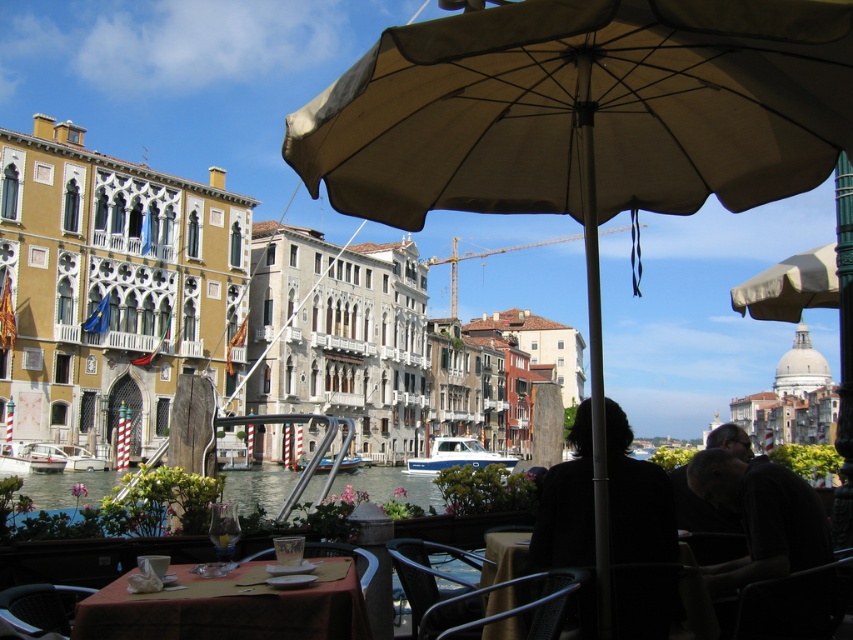
Who is more distant from viewer, [840,65] or [579,573]?

The point [579,573] is behind.

Can you confirm if beige fabric umbrella at center is positioned below metallic silver chair at lower center?

Actually, beige fabric umbrella at center is above metallic silver chair at lower center.

Who is more distant from viewer, [606,35] or [564,598]?

Point [606,35]

This screenshot has height=640, width=853. I want to click on beige fabric umbrella at center, so click(584, 124).

Between clear water at center and metallic gray chair at lower center, which one has less height?

metallic gray chair at lower center is shorter.

Where is `clear water at center`? The image size is (853, 640). clear water at center is located at coordinates (67, 486).

The width and height of the screenshot is (853, 640). Find the location of `clear water at center`. clear water at center is located at coordinates (67, 486).

Is metallic silver table at center to the left of white glossy boat at lower left from the viewer's perspective?

No, metallic silver table at center is not to the left of white glossy boat at lower left.

Can you confirm if metallic silver table at center is positioned to the right of white glossy boat at lower left?

Indeed, metallic silver table at center is positioned on the right side of white glossy boat at lower left.

The image size is (853, 640). I want to click on metallic silver table at center, so click(x=505, y=556).